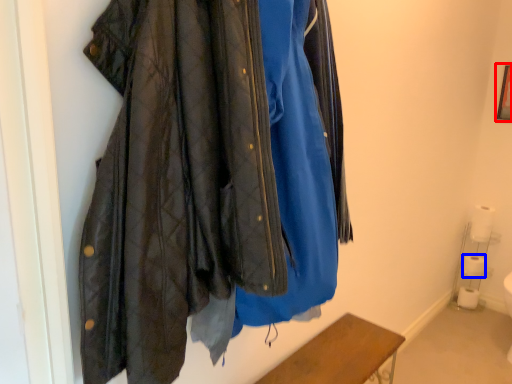
Question: Which point is closer to the camera, picture frame (highlighted by a red box) or toilet paper (highlighted by a blue box)?

Choices:
 (A) picture frame
 (B) toilet paper

Answer: (A)